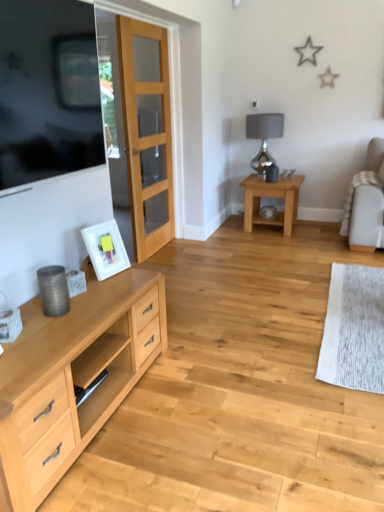
Question: Is light brown wooden table at center-right at the back of white matte picture frame at left?

Choices:
 (A) yes
 (B) no

Answer: (B)

Question: From the image's perspective, is white matte picture frame at left below light brown wooden table at center-right?

Choices:
 (A) yes
 (B) no

Answer: (A)

Question: Is white matte picture frame at left outside of light brown wooden table at center-right?

Choices:
 (A) yes
 (B) no

Answer: (A)

Question: Is white matte picture frame at left in front of light brown wooden table at center-right?

Choices:
 (A) no
 (B) yes

Answer: (B)

Question: Can you confirm if white matte picture frame at left is positioned to the right of light brown wooden table at center-right?

Choices:
 (A) yes
 (B) no

Answer: (B)

Question: Considering the relative positions of silver metallic lamp at upper right and white matte picture frame at left in the image provided, is silver metallic lamp at upper right to the left or to the right of white matte picture frame at left?

Choices:
 (A) right
 (B) left

Answer: (A)

Question: Looking at the image, does silver metallic lamp at upper right seem bigger or smaller compared to white matte picture frame at left?

Choices:
 (A) small
 (B) big

Answer: (B)

Question: Which is correct: silver metallic lamp at upper right is inside white matte picture frame at left, or outside of it?

Choices:
 (A) outside
 (B) inside

Answer: (A)

Question: Is silver metallic lamp at upper right wider or thinner than white matte picture frame at left?

Choices:
 (A) wide
 (B) thin

Answer: (A)

Question: Looking at their shapes, would you say matte gray coffee cup at lower left is wider or thinner than clear glass door at center?

Choices:
 (A) wide
 (B) thin

Answer: (B)

Question: Based on their positions, is matte gray coffee cup at lower left located to the left or right of clear glass door at center?

Choices:
 (A) right
 (B) left

Answer: (B)

Question: From the image's perspective, is matte gray coffee cup at lower left located above or below clear glass door at center?

Choices:
 (A) above
 (B) below

Answer: (B)

Question: Is matte gray coffee cup at lower left inside the boundaries of clear glass door at center, or outside?

Choices:
 (A) outside
 (B) inside

Answer: (A)

Question: Is silver metallic lamp at upper right situated inside matte black tv at left or outside?

Choices:
 (A) outside
 (B) inside

Answer: (A)

Question: Considering the positions of silver metallic lamp at upper right and matte black tv at left in the image, is silver metallic lamp at upper right taller or shorter than matte black tv at left?

Choices:
 (A) tall
 (B) short

Answer: (B)